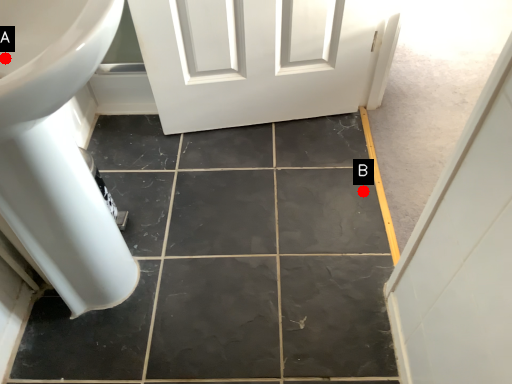
Question: Two points are circled on the image, labeled by A and B beside each circle. Which point appears closest to the camera in this image?

Choices:
 (A) A is closer
 (B) B is closer

Answer: (A)